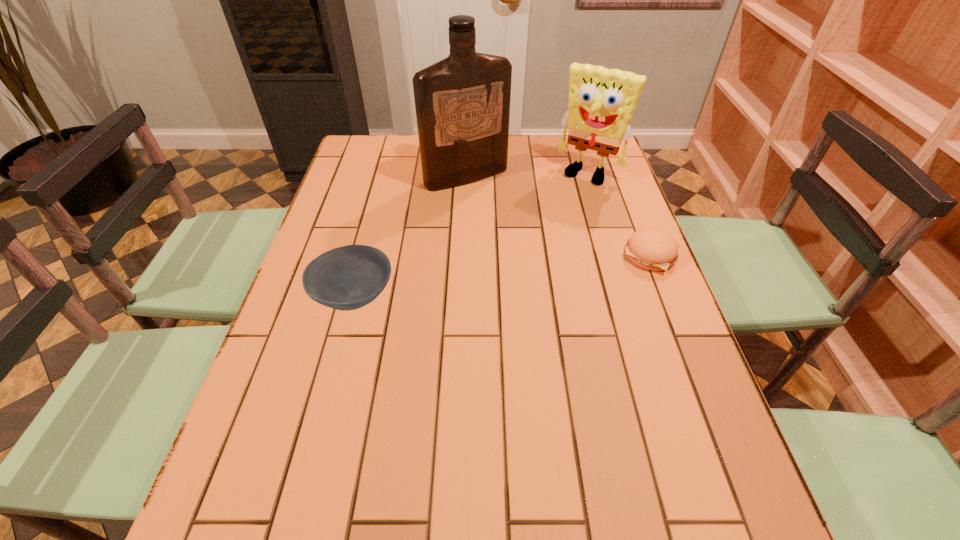
Find the location of `bowl`. bowl is located at coordinates (346, 278).

This screenshot has height=540, width=960. I want to click on the leftmost object, so click(346, 278).

At what (x,y) coordinates should I click in order to perform the action: click on the shortest object. Please return your answer as a coordinate pair (x, y). This screenshot has width=960, height=540. Looking at the image, I should click on (652, 249).

This screenshot has width=960, height=540. Identify the location of the second object from left to right. (462, 102).

I want to click on liquor, so click(x=462, y=102).

The width and height of the screenshot is (960, 540). In order to click on sponge in this screenshot , I will do `click(601, 103)`.

Identify the location of free spot located 0.250m on the back of the second shortest object. (377, 208).

The image size is (960, 540). Find the location of `vacant space situated 0.080m on the left of the patty`. vacant space situated 0.080m on the left of the patty is located at coordinates (591, 256).

You are a GUI agent. You are given a task and a screenshot of the screen. Output one action in this format:
    pyautogui.click(x=<x>, y=<y>)
    Task: Click on the vacant space positioned on the label side of the tallest object
    
    Given the screenshot: What is the action you would take?
    pyautogui.click(x=521, y=232)

Where is `free spot located on the label side of the tallest object`? The image size is (960, 540). free spot located on the label side of the tallest object is located at coordinates (555, 270).